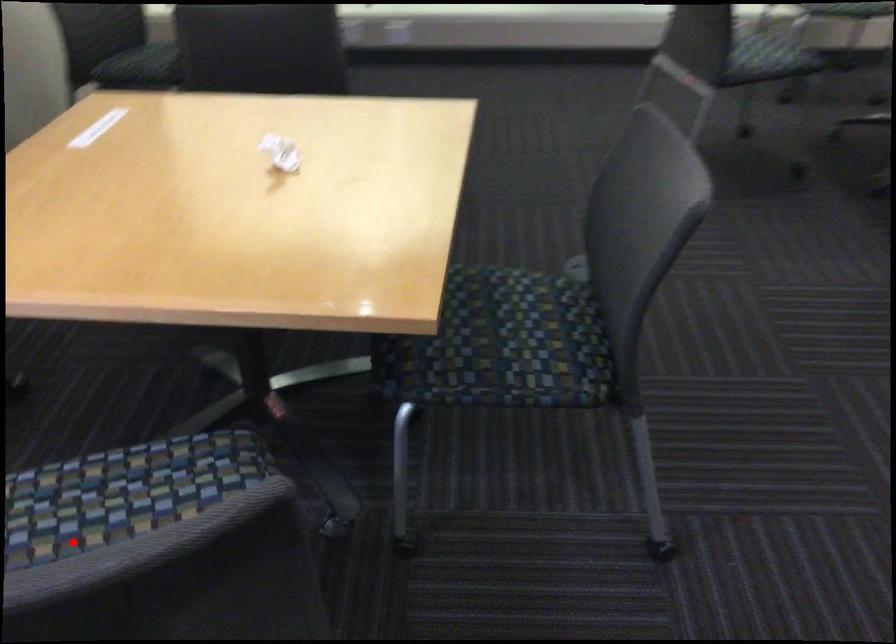
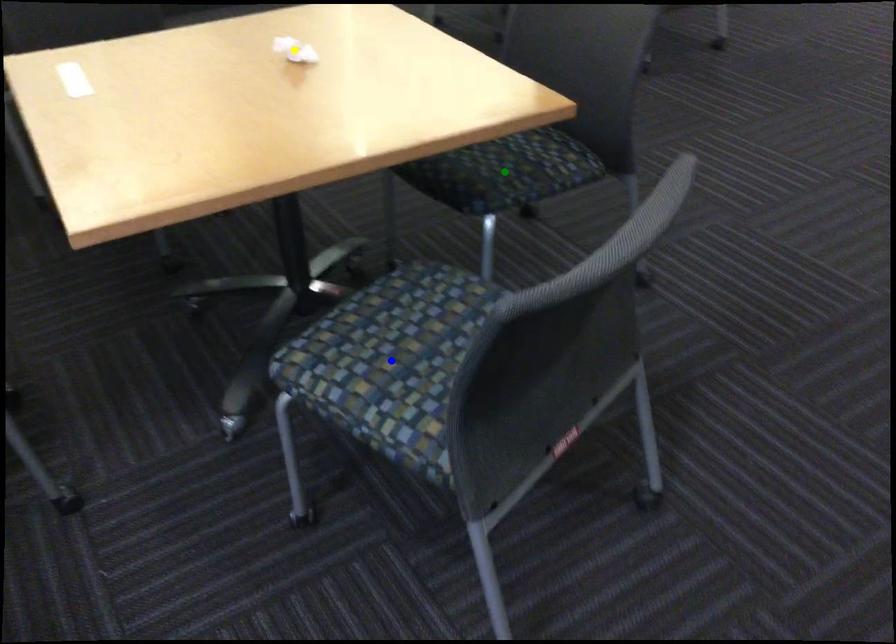
Question: I am providing you with two images of the same scene from different viewpoints. A red point is marked on the first image. You are given multiple points on the second image. Which point in image 2 represents the same 3d spot as the red point in image 1?

Choices:
 (A) yellow point
 (B) blue point
 (C) green point

Answer: (B)